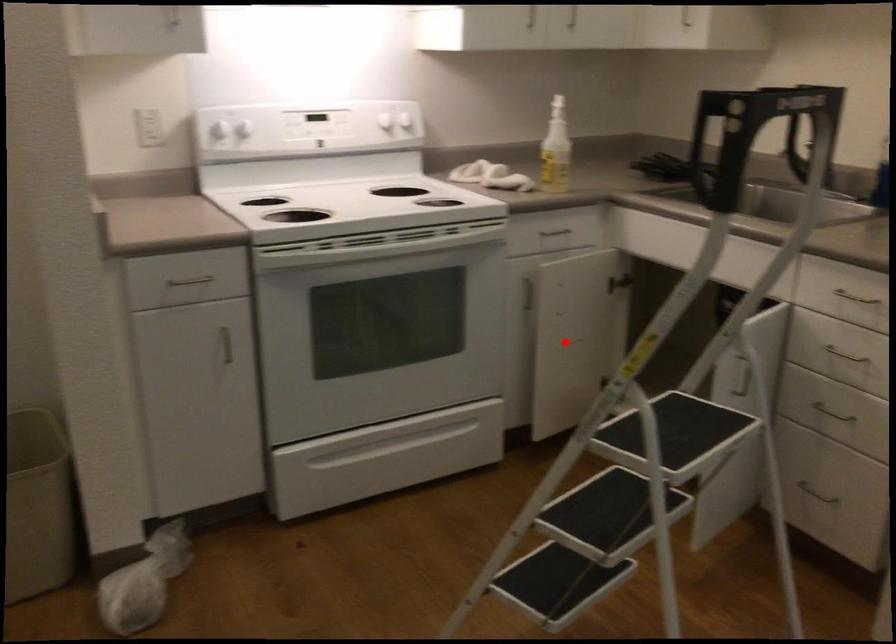
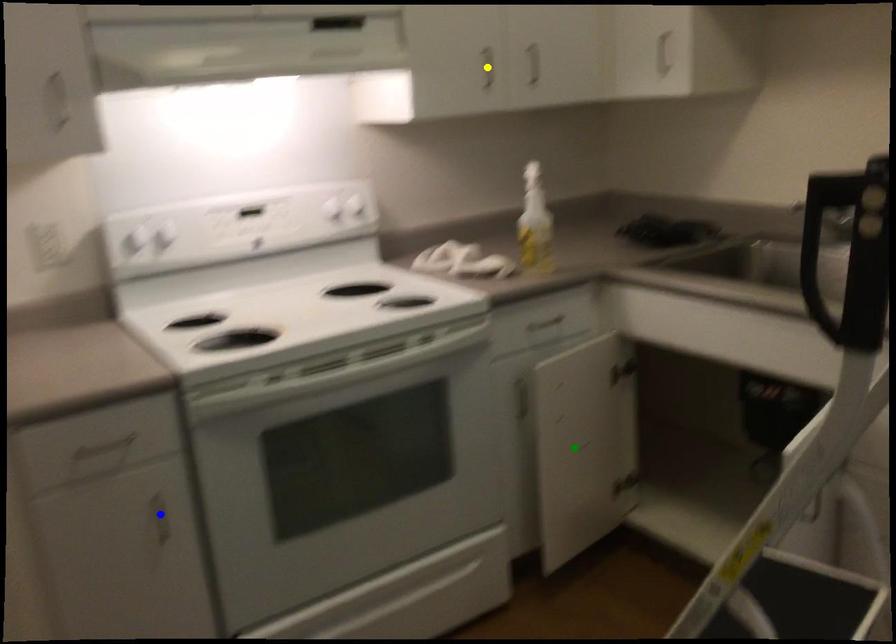
Question: I am providing you with two images of the same scene from different viewpoints. A red point is marked on the first image. You are given multiple points on the second image. Which point in image 2 represents the same 3d spot as the red point in image 1?

Choices:
 (A) blue point
 (B) yellow point
 (C) green point

Answer: (C)